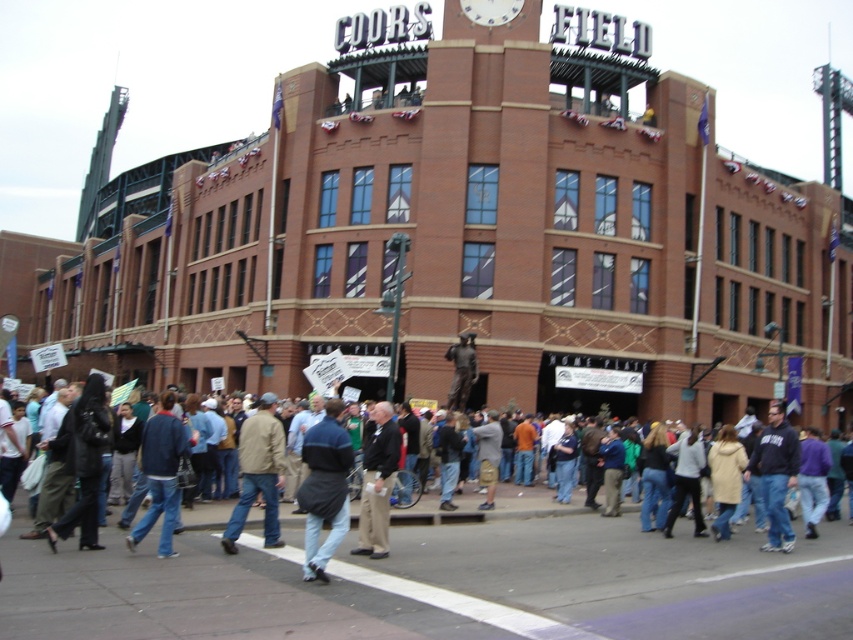
Between light brown leather jacket at center and denim jacket at lower left, which one has more height?

Standing taller between the two is denim jacket at lower left.

Image resolution: width=853 pixels, height=640 pixels. Find the location of `light brown leather jacket at center`. light brown leather jacket at center is located at coordinates (258, 472).

You are a GUI agent. You are given a task and a screenshot of the screen. Output one action in this format:
    pyautogui.click(x=<x>, y=<y>)
    Task: Click on the light brown leather jacket at center
    The width and height of the screenshot is (853, 640).
    Given the screenshot: What is the action you would take?
    pyautogui.click(x=258, y=472)

Which is in front, point (354, 516) or point (155, 456)?

Point (155, 456)

Does denim jacket at center have a larger size compared to denim jacket at lower left?

Yes.

Who is more distant from viewer, (x=198, y=516) or (x=169, y=529)?

Point (x=198, y=516)

Where is `denim jacket at center`? denim jacket at center is located at coordinates (488, 512).

The width and height of the screenshot is (853, 640). Describe the element at coordinates (161, 472) in the screenshot. I see `denim jacket at lower left` at that location.

Does point (138, 524) lie behind point (781, 536)?

That is False.

Is point (170, 451) closer to camera compared to point (764, 500)?

That is True.

Locate an element on the screen. The image size is (853, 640). denim jacket at lower left is located at coordinates (161, 472).